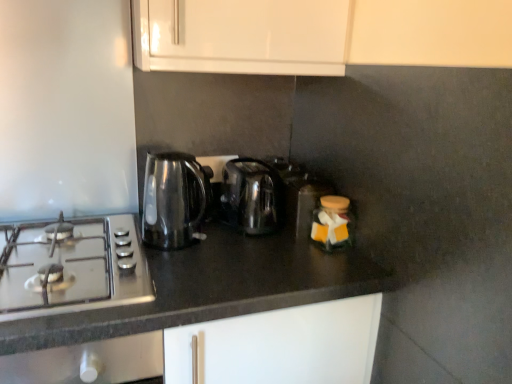
Question: In terms of height, does transparent glass kettle at left, which ranks as the 2th kitchen appliance in right-to-left order, look taller or shorter compared to matte glass jar at center right, marked as the 1th appliance in a front-to-back arrangement?

Choices:
 (A) short
 (B) tall

Answer: (B)

Question: From a real-world perspective, is transparent glass kettle at left, which ranks as the 2th kitchen appliance in right-to-left order, physically located above or below matte glass jar at center right, marked as the 1th appliance in a front-to-back arrangement?

Choices:
 (A) below
 (B) above

Answer: (B)

Question: Which is farther from the black granite countertop at center?

Choices:
 (A) matte glass jar at center right, marked as the 1th appliance in a front-to-back arrangement
 (B) translucent plastic container at center, positioned as the first appliance in back-to-front order
 (C) transparent glass kettle at left, acting as the 1th kitchen appliance starting from the left
 (D) satin silver gas stove at left
 (E) stainless steel kettle at center, the 1th kitchen appliance viewed from the right

Answer: (B)

Question: Based on their relative distances, which object is nearer to the transparent glass kettle at left, which ranks as the 2th kitchen appliance in right-to-left order?

Choices:
 (A) stainless steel kettle at center, the 1th kitchen appliance viewed from the right
 (B) translucent plastic container at center, arranged as the second appliance when viewed from the front
 (C) satin silver gas stove at left
 (D) matte glass jar at center right, which is counted as the 2th appliance, starting from the back
 (E) black granite countertop at center

Answer: (A)